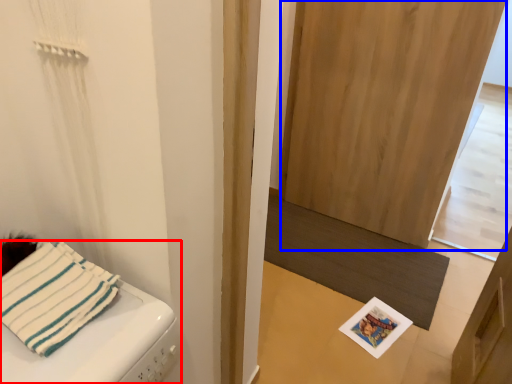
Question: Which object is further to the camera taking this photo, furniture (highlighted by a red box) or screen door (highlighted by a blue box)?

Choices:
 (A) furniture
 (B) screen door

Answer: (B)